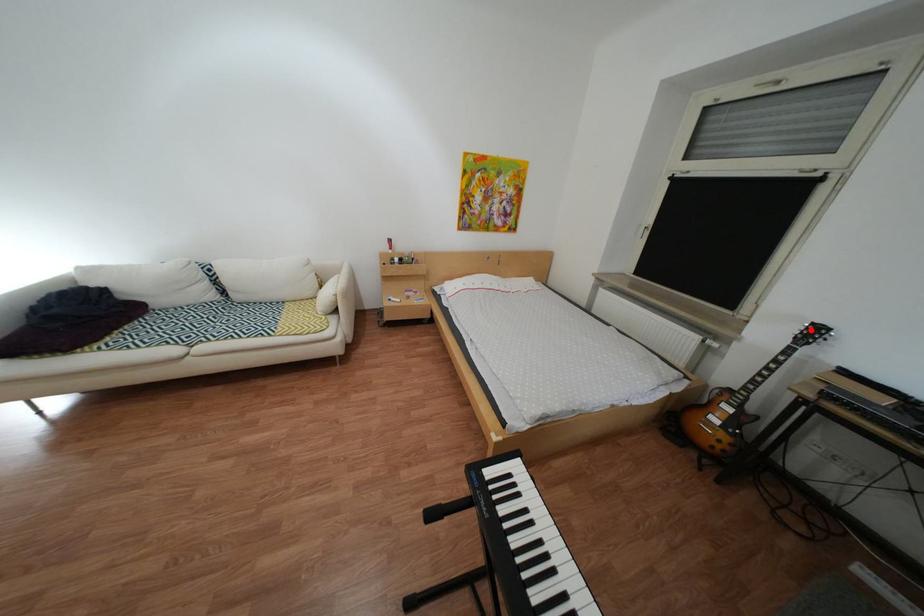
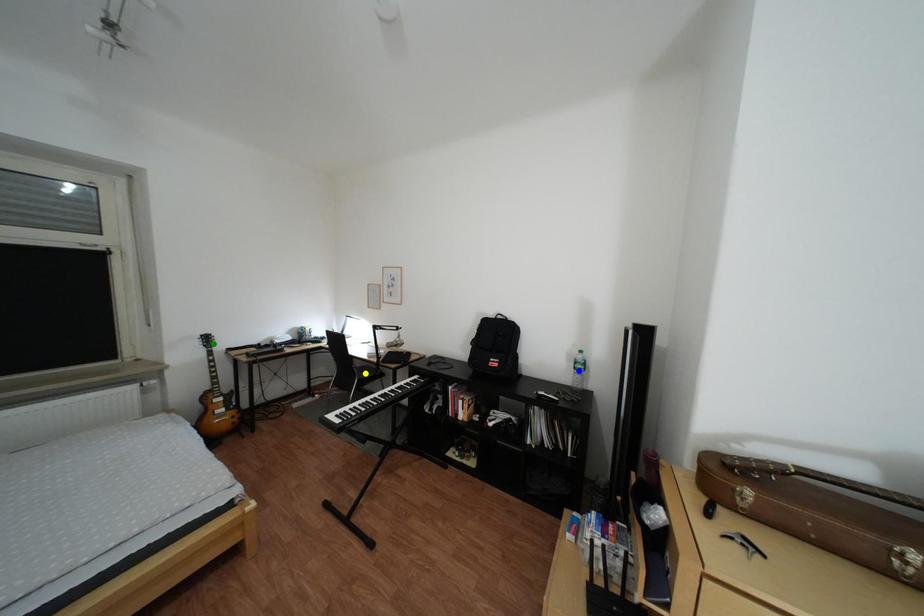
Question: I am providing you with two images of the same scene from different viewpoints. A red point is marked on the first image. You are given multiple points on the second image. Which point in image 2 represents the same 3d spot as the red point in image 1?

Choices:
 (A) blue point
 (B) yellow point
 (C) green point

Answer: (C)